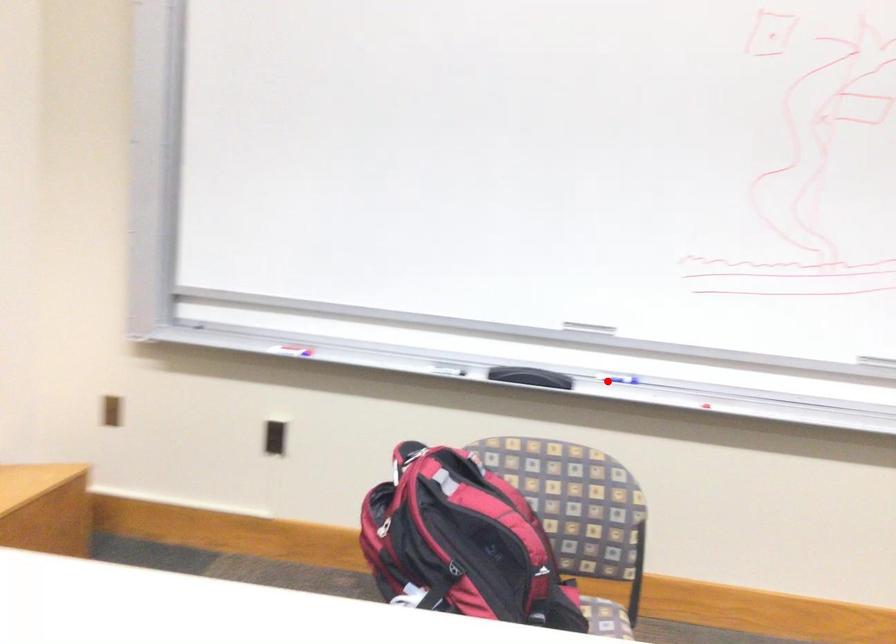
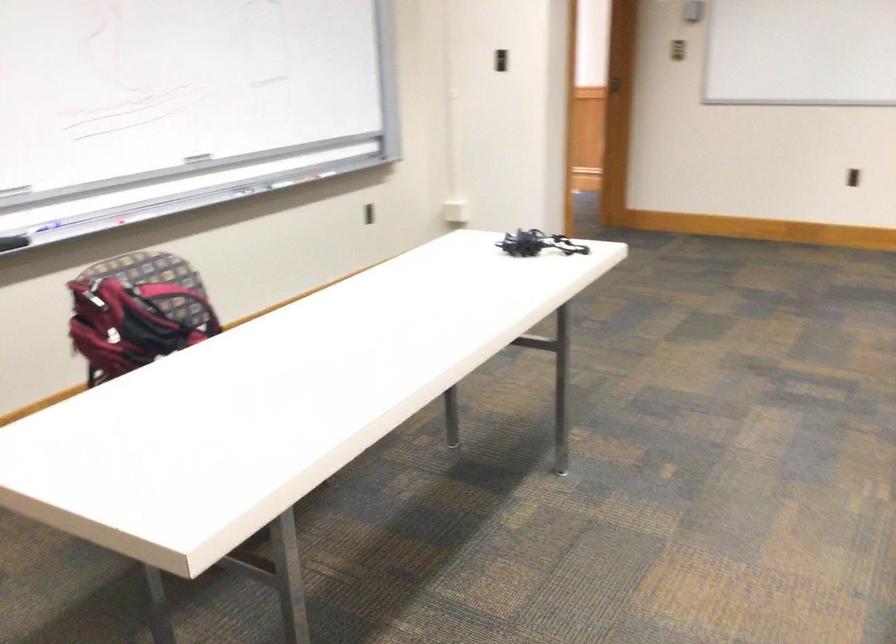
Question: A red point is marked in image1. In image2, is the corresponding 3D point closer to the camera or farther? Reply with the corresponding letter.

Choices:
 (A) The corresponding 3D point is closer.
 (B) The corresponding 3D point is farther.

Answer: (B)